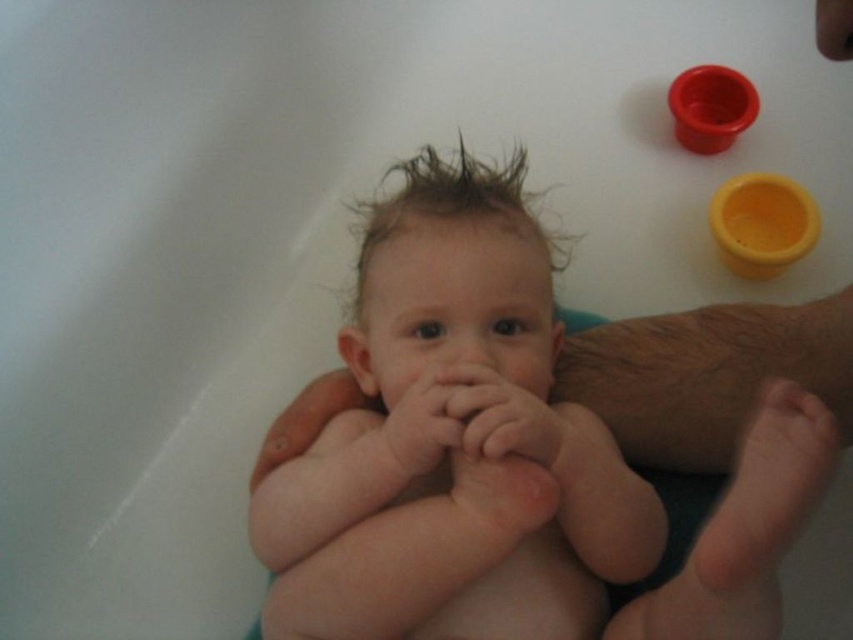
Does pink soft skin at center appear under yellow matte cup at upper right?

Yes.

Does point (422, 380) lie in front of point (770, 177)?

Yes, point (422, 380) is in front of point (770, 177).

You are a GUI agent. You are given a task and a screenshot of the screen. Output one action in this format:
    pyautogui.click(x=<x>, y=<y>)
    Task: Click on the pink soft skin at center
    Image resolution: width=853 pixels, height=640 pixels.
    Given the screenshot: What is the action you would take?
    480,416

Which of these two, yellow matte cup at upper right or matte plastic cup at upper right, stands taller?

With more height is yellow matte cup at upper right.

Which is above, yellow matte cup at upper right or matte plastic cup at upper right?

matte plastic cup at upper right is above.

Is point (769, 243) more distant than point (694, 140)?

No, (769, 243) is in front of (694, 140).

Image resolution: width=853 pixels, height=640 pixels. Identify the location of yellow matte cup at upper right. (762, 224).

Is pink soft skin at center closer to camera compared to matte plastic cup at upper right?

Yes, it is.

Is pink soft skin at center to the right of matte plastic cup at upper right from the viewer's perspective?

In fact, pink soft skin at center is to the left of matte plastic cup at upper right.

Between point (459, 404) and point (699, 150), which one is positioned behind?

The point (699, 150) is more distant.

I want to click on pink soft skin at center, so click(x=480, y=416).